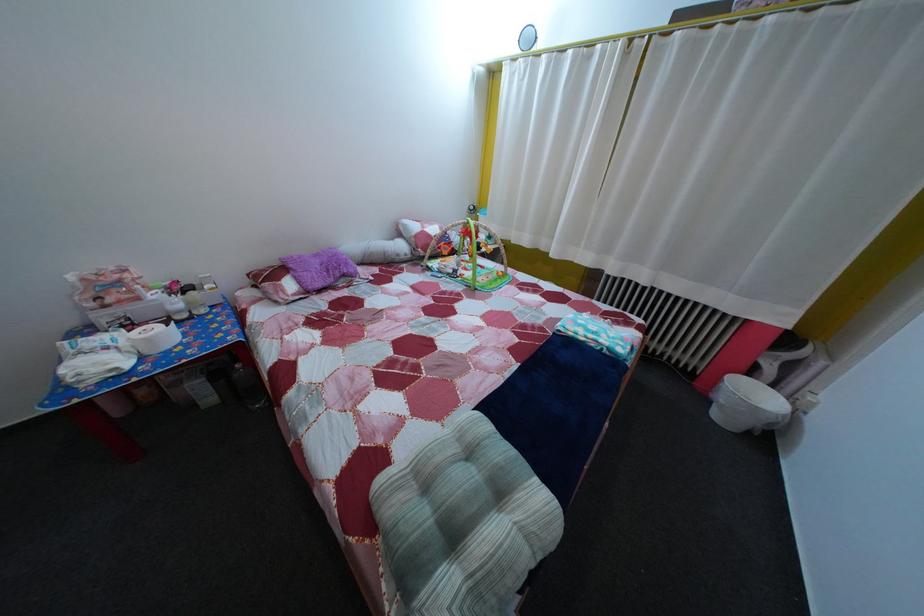
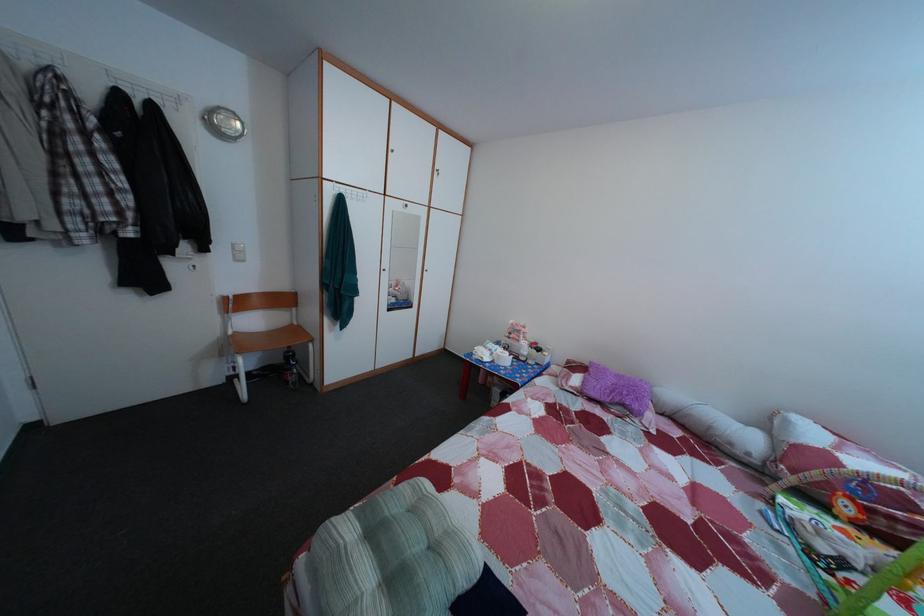
Find the pixel in the second image that matches (x=148, y=307) in the first image.

(528, 349)